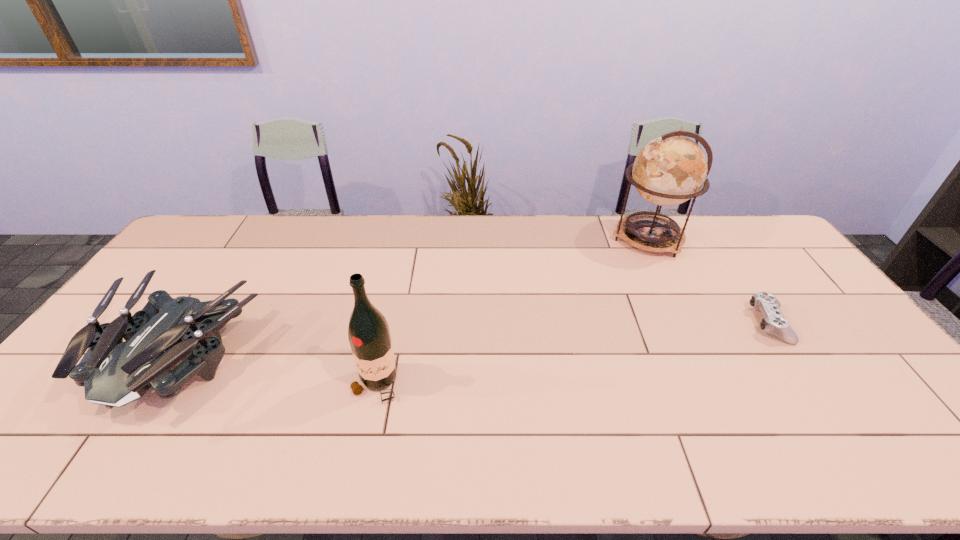
The height and width of the screenshot is (540, 960). Identify the location of free area in between the rightmost object and the farthest object. (709, 281).

This screenshot has height=540, width=960. What are the coordinates of `free point between the third tallest object and the control` in the screenshot? It's located at (475, 340).

Find the location of a particular element. vacant point located between the third object from right to left and the rightmost object is located at coordinates (573, 354).

Find the location of a particular element. This screenshot has width=960, height=540. unoccupied position between the second shortest object and the rightmost object is located at coordinates (475, 340).

Where is `free space between the control and the leftmost object`? The image size is (960, 540). free space between the control and the leftmost object is located at coordinates (475, 340).

At what (x,y) coordinates should I click in order to perform the action: click on free spot between the drone and the rightmost object. Please return your answer as a coordinate pair (x, y). The image size is (960, 540). Looking at the image, I should click on (475, 340).

The image size is (960, 540). In order to click on vacant space in between the farthest object and the second object from left to right in this screenshot , I will do click(512, 312).

Where is `vacant space in between the shortest object and the third shortest object`? This screenshot has width=960, height=540. vacant space in between the shortest object and the third shortest object is located at coordinates (573, 354).

Identify the location of vacant region between the third shortest object and the control. The height and width of the screenshot is (540, 960). (573, 354).

The image size is (960, 540). In order to click on vacant space that's between the leftmost object and the control in this screenshot , I will do 475,340.